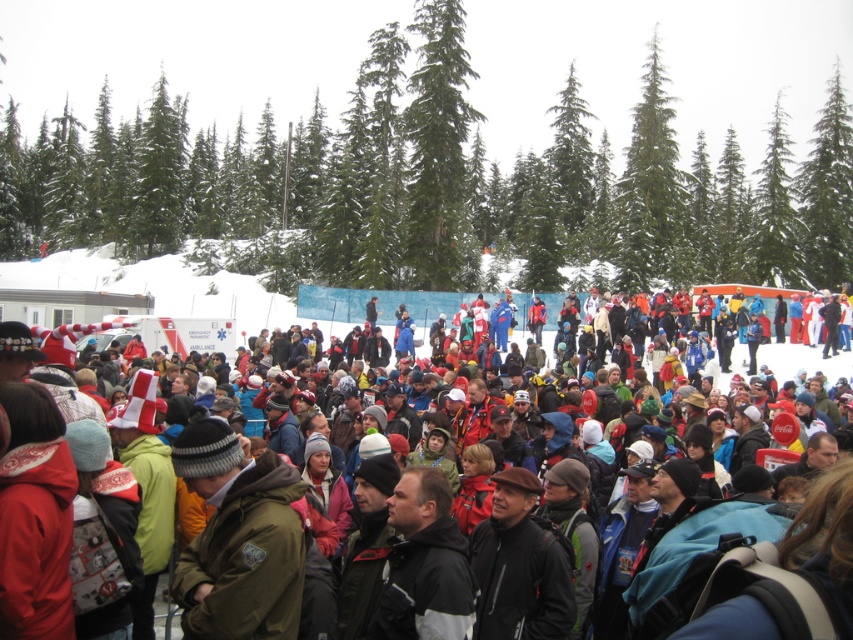
Question: Does green textured trees at upper center appear over matte black jacket at center?

Choices:
 (A) no
 (B) yes

Answer: (B)

Question: Which point appears farthest from the camera in this image?

Choices:
 (A) (202, 304)
 (B) (374, 100)

Answer: (B)

Question: Which point is closer to the camera?

Choices:
 (A) matte black jacket at center
 (B) green textured trees at upper center

Answer: (A)

Question: Which point is closer to the camera?

Choices:
 (A) matte black jacket at center
 (B) green textured trees at upper center

Answer: (A)

Question: Does green textured trees at upper center appear on the right side of matte black jacket at center?

Choices:
 (A) no
 (B) yes

Answer: (A)

Question: Can you confirm if green textured trees at upper center is positioned below matte black jacket at center?

Choices:
 (A) yes
 (B) no

Answer: (B)